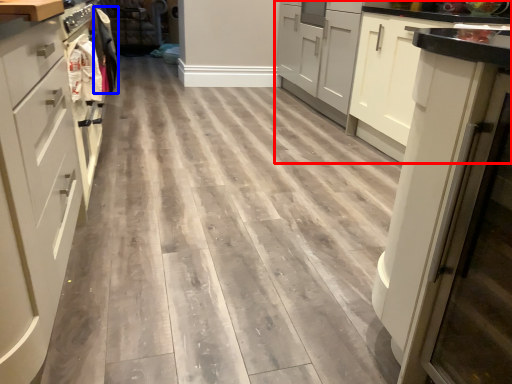
Question: Which of the following is the farthest to the observer, cabinetry (highlighted by a red box) or laundry (highlighted by a blue box)?

Choices:
 (A) cabinetry
 (B) laundry

Answer: (B)